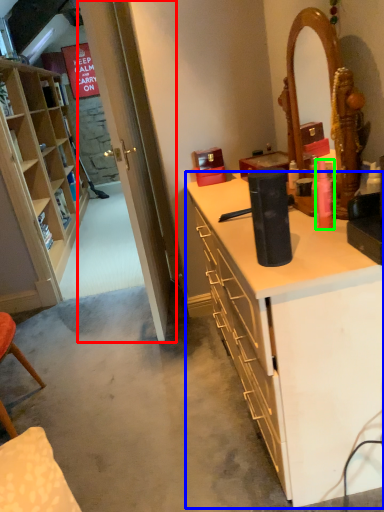
Question: Considering the real-world distances, which object is farthest from glass door (highlighted by a red box)? desk (highlighted by a blue box) or toiletry (highlighted by a green box)?

Choices:
 (A) desk
 (B) toiletry

Answer: (B)